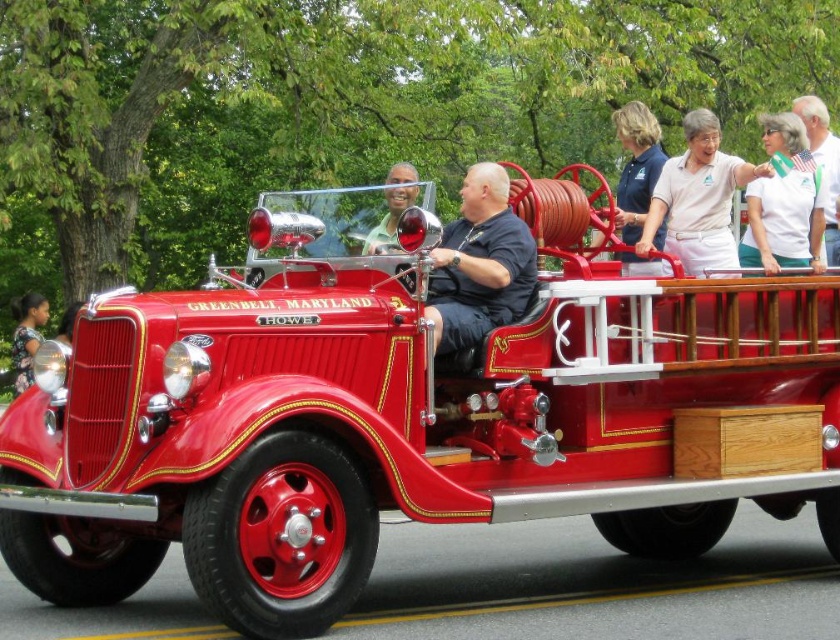
Which is in front, point (586, 278) or point (500, 195)?

Positioned in front is point (586, 278).

Between point (718, 362) and point (445, 228), which one is positioned in front?

Point (718, 362)

The image size is (840, 640). Find the location of `shiny red fire truck at center`. shiny red fire truck at center is located at coordinates (405, 413).

Which is behind, point (494, 269) or point (18, 339)?

The point (18, 339) is more distant.

Which is in front, point (529, 296) or point (16, 387)?

Positioned in front is point (529, 296).

Locate an element on the screen. This screenshot has width=840, height=640. matte black shirt at center is located at coordinates (480, 264).

In the scene shown: Can you confirm if white cotton shirt at upper center is wider than white fabric shirt at upper right?

Indeed, white cotton shirt at upper center has a greater width compared to white fabric shirt at upper right.

Consider the image. Does white cotton shirt at upper center have a larger size compared to white fabric shirt at upper right?

Correct, white cotton shirt at upper center is larger in size than white fabric shirt at upper right.

Describe the element at coordinates (697, 198) in the screenshot. The width and height of the screenshot is (840, 640). I see `white cotton shirt at upper center` at that location.

This screenshot has height=640, width=840. In order to click on white cotton shirt at upper center in this screenshot , I will do `click(697, 198)`.